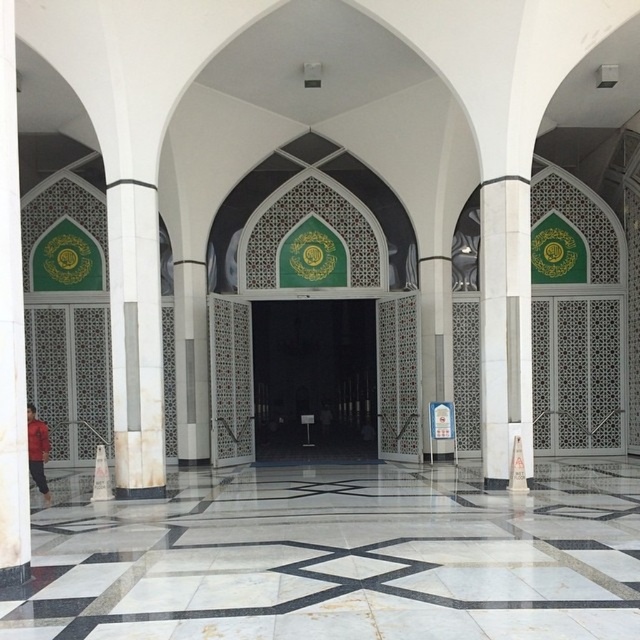
You are standing in the grand mosque and want to enter through the transparent glass door at center. To avoid bumping into the white marble pillar at left, which direction should you move relative to the pillar?

The transparent glass door at center is located below the white marble pillar at left, so you should move to the right of the pillar to reach the door safely.

You are standing in the grand mosque and want to take a photo of the entrance. The camera you are using has a focal length of 50mm and a sensor size of 24mm x 36mm. The entrance is at point (312, 381). What is the minimum distance you need to move forward to ensure the entrance fills the frame vertically?

The entrance is at point (312, 381) and is 32.36 meters away. To calculate the required distance, use the formula for field of view. The vertical field of view at 32.36 meters is 24mm multiplied by the distance divided by the focal length. However, since the entrance is already within the frame, you might not need to move closer. Alternatively, if the entrance is not filling the frame, adjust the distance using the formula distance_new equals focal length multiplied by object height divided by sensor size

You are a visitor entering the mosque and want to know if you can pass through the transparent glass door at center without touching the white marble pillar at left. Based on their sizes, can you fit through the door without any issues?

The transparent glass door at center is larger in size than the white marble pillar at left, so you can fit through the door without touching the pillar since the door is bigger.